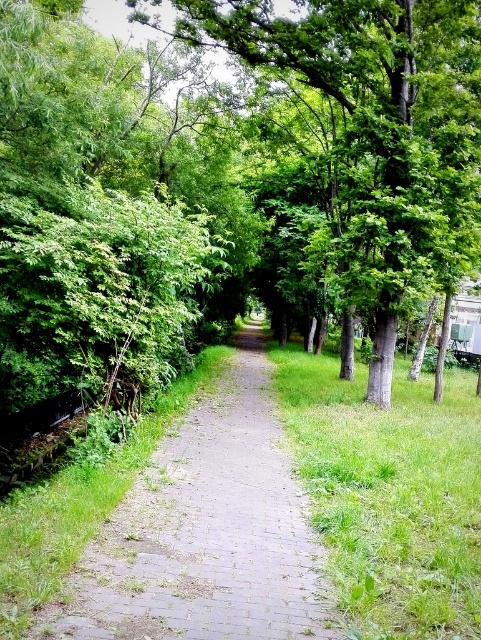
Question: Is green leafy tree at center behind gray brick path at center?

Choices:
 (A) yes
 (B) no

Answer: (A)

Question: Is green leafy tree at center wider than gray brick path at center?

Choices:
 (A) yes
 (B) no

Answer: (A)

Question: Does green leafy tree at center appear under gray brick path at center?

Choices:
 (A) no
 (B) yes

Answer: (A)

Question: Which point appears farthest from the camera in this image?

Choices:
 (A) (233, 26)
 (B) (192, 612)

Answer: (A)

Question: Which point is farther to the camera?

Choices:
 (A) (392, 316)
 (B) (274, 432)

Answer: (A)

Question: Which object appears closest to the camera in this image?

Choices:
 (A) green leafy tree at center
 (B) gray brick path at center

Answer: (B)